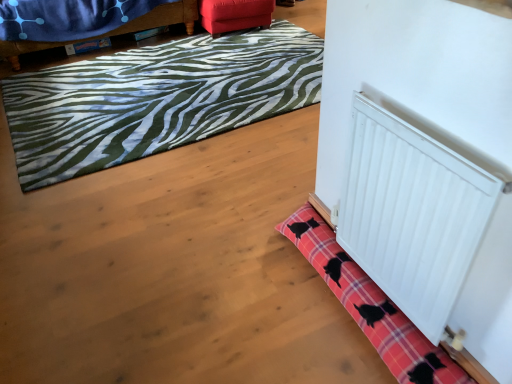
Locate an element on the screen. vacant point above pink plaid bath mat at lower right, the 2th bath mat in the back-to-front sequence (from a real-world perspective) is located at coordinates (365, 276).